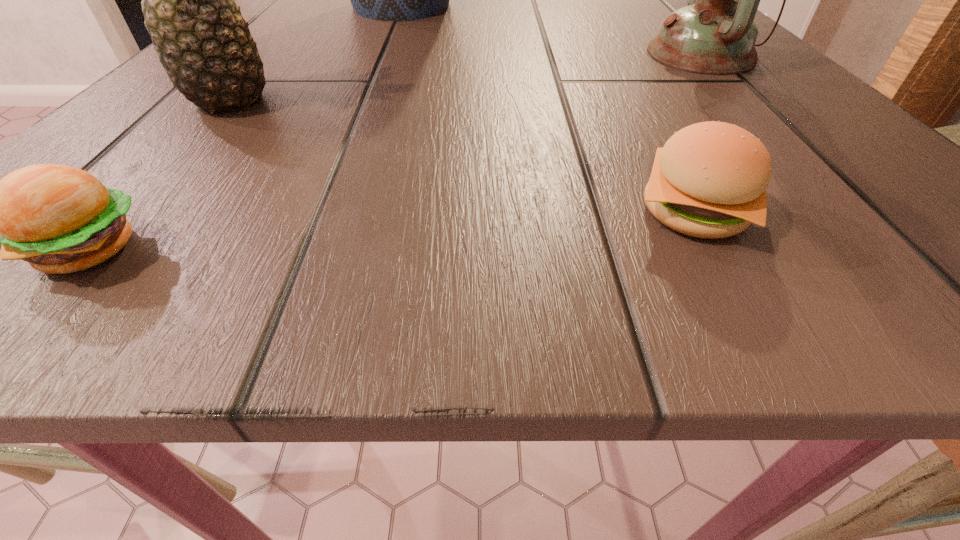
Locate an element on the screen. oil lamp is located at coordinates (715, 34).

This screenshot has width=960, height=540. Find the location of `the rightmost object`. the rightmost object is located at coordinates (715, 34).

This screenshot has width=960, height=540. In order to click on the third farthest object in this screenshot , I will do `click(204, 44)`.

This screenshot has height=540, width=960. I want to click on the fourth object from left to right, so click(709, 180).

Locate an element on the screen. The image size is (960, 540). vacant region located 0.150m on the front of the oil lamp is located at coordinates (781, 140).

This screenshot has height=540, width=960. Find the location of `vacant space located on the back of the third nearest object`. vacant space located on the back of the third nearest object is located at coordinates pyautogui.click(x=309, y=15).

Identify the location of blank area located on the back of the fourth object from left to right. (660, 148).

Find the location of a particular element. The height and width of the screenshot is (540, 960). object at the near edge is located at coordinates (709, 180).

Where is `object that is at the left edge`? object that is at the left edge is located at coordinates (204, 44).

Identify the location of oil lamp at the right edge. Image resolution: width=960 pixels, height=540 pixels. (715, 34).